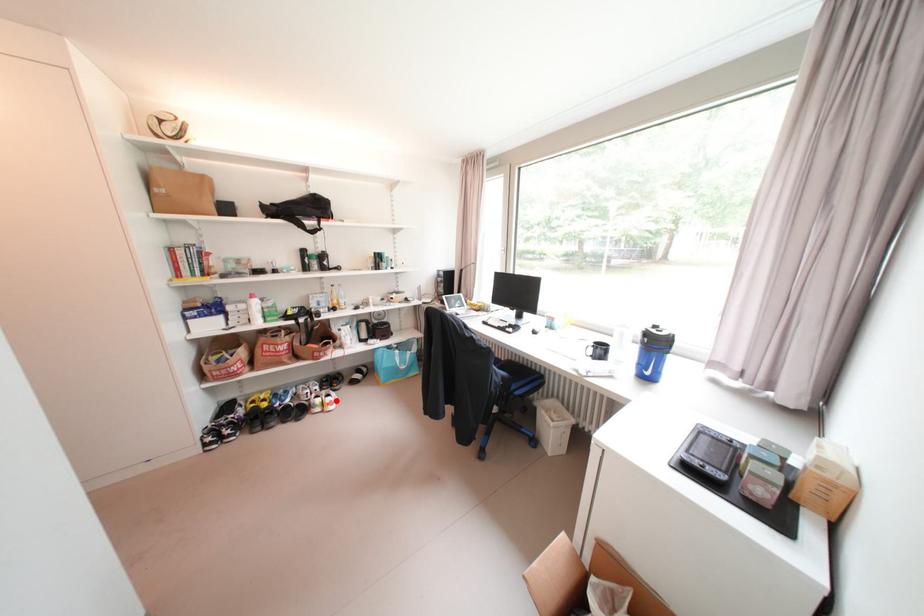
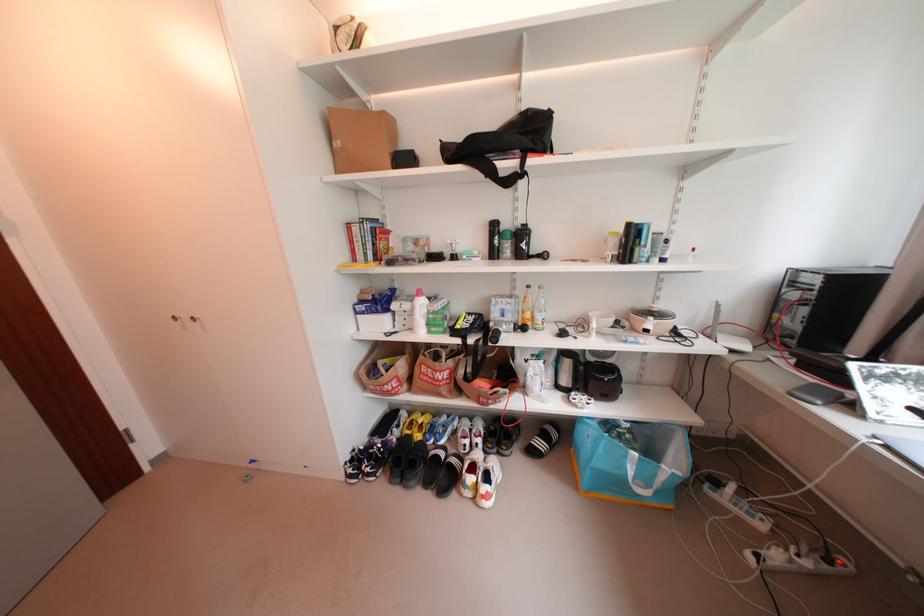
Question: A red point is marked in image1. In image2, is the corresponding 3D point closer to the camera or farther? Reply with the corresponding letter.

Choices:
 (A) The corresponding 3D point is closer.
 (B) The corresponding 3D point is farther.

Answer: (B)